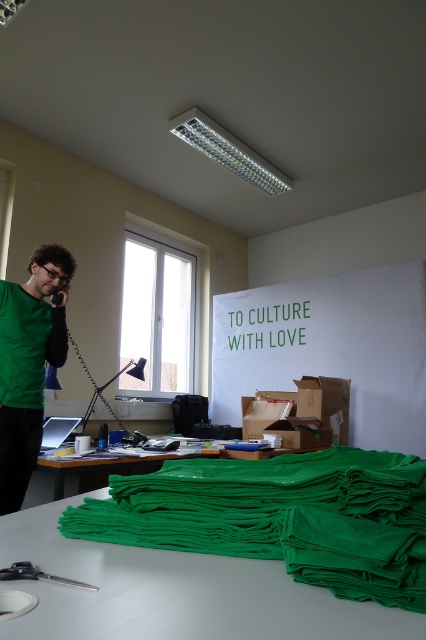
Question: Which point is farther to the camera?

Choices:
 (A) (137, 467)
 (B) (275, 506)
 (C) (29, 320)

Answer: (A)

Question: Which point is farther to the camera?

Choices:
 (A) (26, 282)
 (B) (190, 444)
 (C) (380, 460)

Answer: (B)

Question: Can you confirm if green fabric at lower center is positioned below green fabric at center?

Choices:
 (A) yes
 (B) no

Answer: (B)

Question: Among these objects, which one is nearest to the camera?

Choices:
 (A) green matte shirt at left
 (B) green fabric at center
 (C) green fabric at lower center

Answer: (C)

Question: Can you confirm if green matte shirt at left is wider than green fabric at center?

Choices:
 (A) no
 (B) yes

Answer: (A)

Question: In this image, where is green fabric at lower center located relative to green fabric at center?

Choices:
 (A) below
 (B) above

Answer: (B)